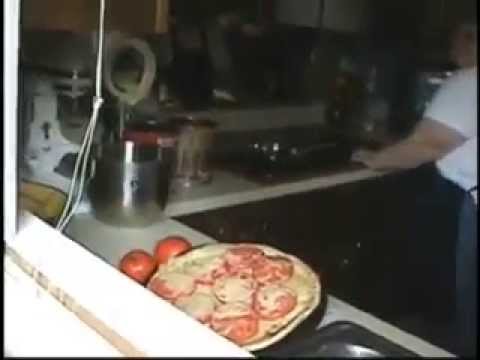
Locate an element on the screen. This screenshot has width=480, height=360. white counter top is located at coordinates (122, 238), (223, 180), (368, 322).